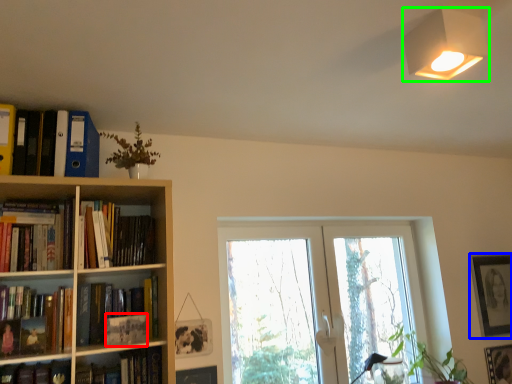
Question: Based on their relative distances, which object is farther from paperback book (highlighted by a red box)? Choose from picture frame (highlighted by a blue box) and lamp (highlighted by a green box).

Choices:
 (A) picture frame
 (B) lamp

Answer: (A)